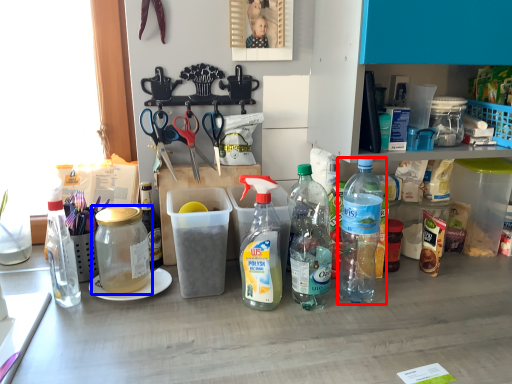
Question: Which of the following is the farthest to the observer, bottle (highlighted by a red box) or bottle (highlighted by a blue box)?

Choices:
 (A) bottle
 (B) bottle

Answer: (B)